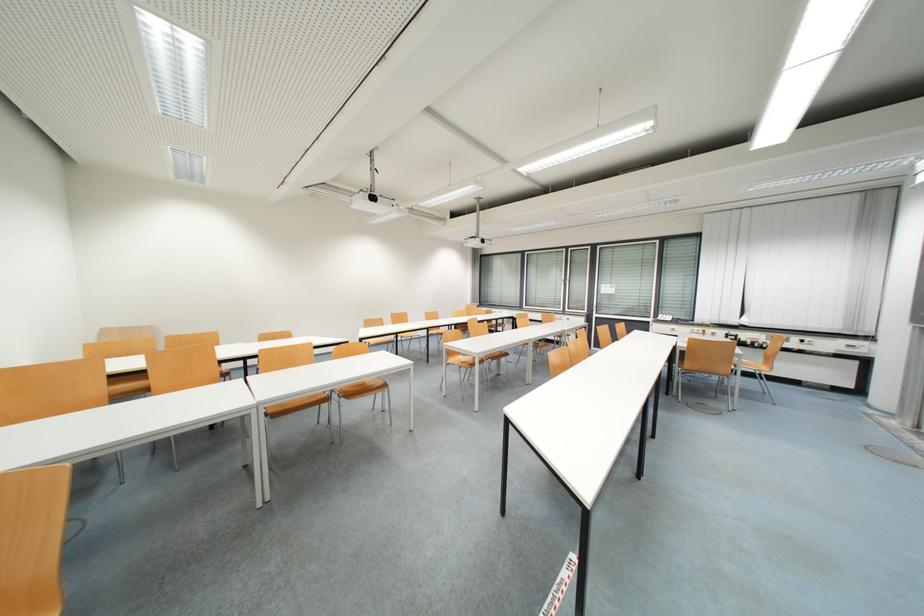
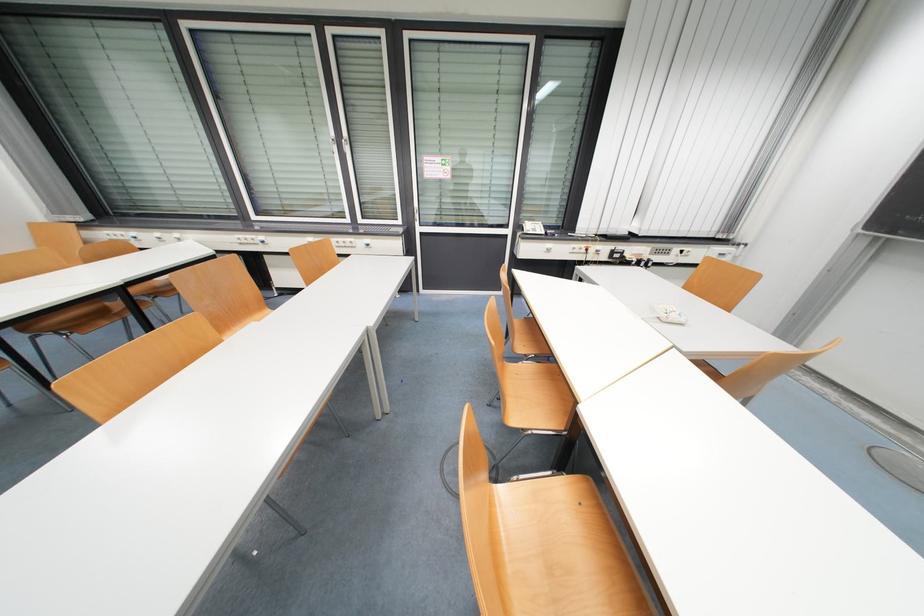
Where in the second image is the point corresponding to (661,318) from the first image?

(524, 229)